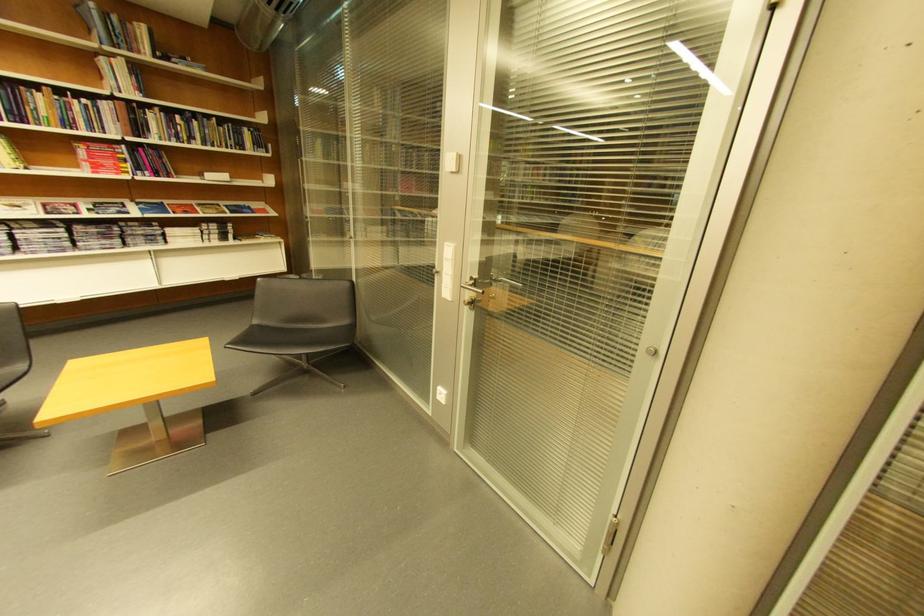
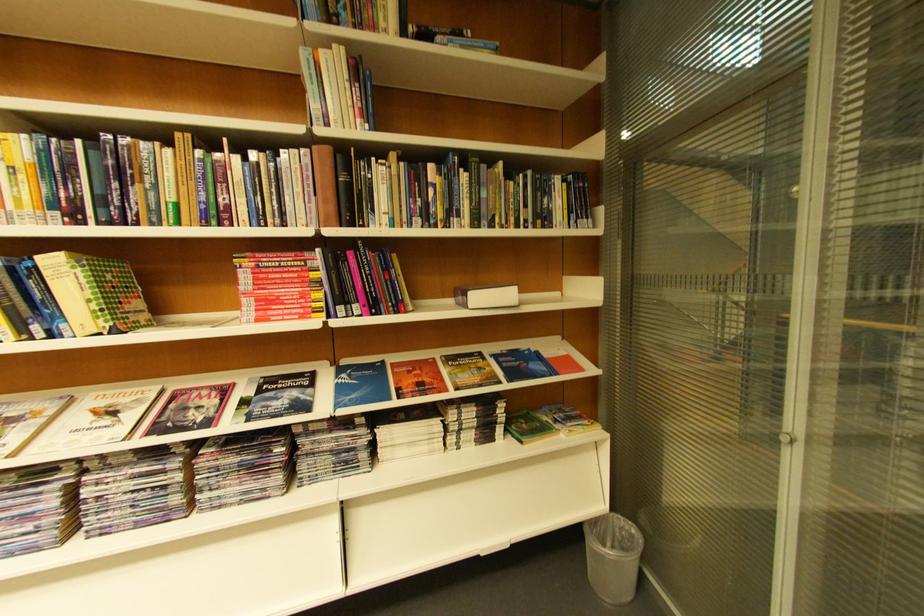
Where in the second image is the point corresponding to [157,175] from the first image?

(367, 310)